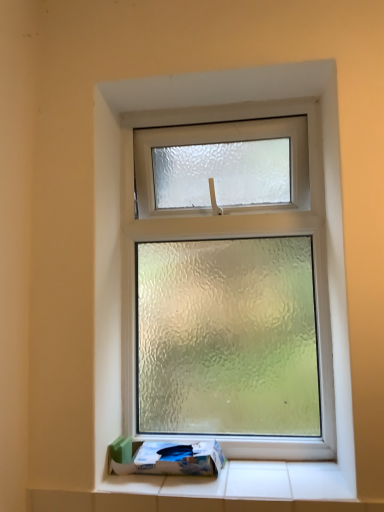
Question: Is white cardboard box at bottom at the left side of frosted glass window at center?

Choices:
 (A) no
 (B) yes

Answer: (B)

Question: Considering the relative positions of white cardboard box at bottom and frosted glass window at center in the image provided, is white cardboard box at bottom to the right of frosted glass window at center from the viewer's perspective?

Choices:
 (A) no
 (B) yes

Answer: (A)

Question: Considering the relative sizes of white cardboard box at bottom and frosted glass window at center in the image provided, is white cardboard box at bottom taller than frosted glass window at center?

Choices:
 (A) no
 (B) yes

Answer: (A)

Question: From the image's perspective, does white cardboard box at bottom appear higher than frosted glass window at center?

Choices:
 (A) yes
 (B) no

Answer: (B)

Question: Is white cardboard box at bottom in front of frosted glass window at center?

Choices:
 (A) no
 (B) yes

Answer: (B)

Question: Can you confirm if white cardboard box at bottom is smaller than frosted glass window at center?

Choices:
 (A) yes
 (B) no

Answer: (A)

Question: Is frosted glass window at center positioned in front of white cardboard box at bottom?

Choices:
 (A) yes
 (B) no

Answer: (B)

Question: From a real-world perspective, is frosted glass window at center physically above white cardboard box at bottom?

Choices:
 (A) no
 (B) yes

Answer: (B)

Question: Considering the relative sizes of frosted glass window at center and white cardboard box at bottom in the image provided, is frosted glass window at center smaller than white cardboard box at bottom?

Choices:
 (A) no
 (B) yes

Answer: (A)

Question: Does frosted glass window at center have a larger size compared to white cardboard box at bottom?

Choices:
 (A) yes
 (B) no

Answer: (A)

Question: Is the depth of frosted glass window at center greater than that of white cardboard box at bottom?

Choices:
 (A) no
 (B) yes

Answer: (B)

Question: Is frosted glass window at center placed right next to white cardboard box at bottom?

Choices:
 (A) no
 (B) yes

Answer: (A)

Question: Is white cardboard box at bottom inside or outside of frosted glass window at center?

Choices:
 (A) inside
 (B) outside

Answer: (B)